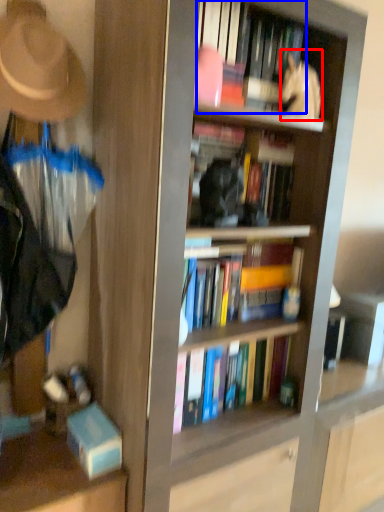
Question: Which point is further to the camera, person (highlighted by a red box) or book (highlighted by a blue box)?

Choices:
 (A) person
 (B) book

Answer: (A)